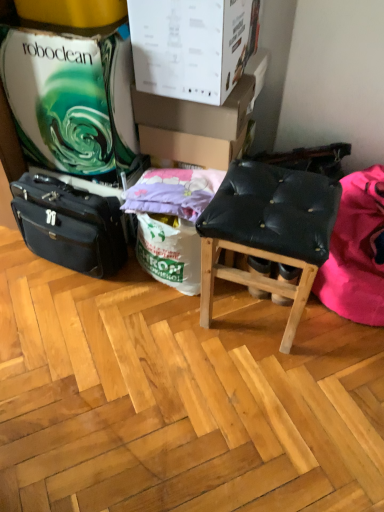
Question: Is the depth of white cardboard box at upper center, placed as the 1th cardboard box when sorted from front to back, greater than that of purple cotton pillow at center?

Choices:
 (A) no
 (B) yes

Answer: (A)

Question: Is white cardboard box at upper center, placed as the 1th cardboard box when sorted from front to back, thinner than purple cotton pillow at center?

Choices:
 (A) no
 (B) yes

Answer: (A)

Question: Is white cardboard box at upper center, placed as the third cardboard box when sorted from back to front, beside purple cotton pillow at center?

Choices:
 (A) yes
 (B) no

Answer: (B)

Question: Can you confirm if white cardboard box at upper center, placed as the 1th cardboard box when sorted from front to back, is positioned to the right of purple cotton pillow at center?

Choices:
 (A) no
 (B) yes

Answer: (B)

Question: Is white cardboard box at upper center, placed as the third cardboard box when sorted from back to front, surrounding purple cotton pillow at center?

Choices:
 (A) no
 (B) yes

Answer: (A)

Question: Choose the correct answer: Is purple cotton pillow at center inside black leather stool at center or outside it?

Choices:
 (A) inside
 (B) outside

Answer: (B)

Question: Is point (152, 170) closer or farther from the camera than point (288, 207)?

Choices:
 (A) farther
 (B) closer

Answer: (A)

Question: From the image's perspective, is purple cotton pillow at center above or below black leather stool at center?

Choices:
 (A) below
 (B) above

Answer: (B)

Question: Considering the positions of purple cotton pillow at center and black leather stool at center in the image, is purple cotton pillow at center wider or thinner than black leather stool at center?

Choices:
 (A) thin
 (B) wide

Answer: (A)

Question: From the image's perspective, relative to cardboard box at upper center, which appears as the 2th cardboard box when viewed from the back, is purple cotton pillow at center above or below?

Choices:
 (A) above
 (B) below

Answer: (B)

Question: Visually, is purple cotton pillow at center positioned to the left or to the right of cardboard box at upper center, which appears as the 2th cardboard box when viewed from the back?

Choices:
 (A) right
 (B) left

Answer: (B)

Question: Considering the positions of purple cotton pillow at center and cardboard box at upper center, acting as the second cardboard box starting from the front, in the image, is purple cotton pillow at center bigger or smaller than cardboard box at upper center, acting as the second cardboard box starting from the front,?

Choices:
 (A) small
 (B) big

Answer: (A)

Question: Would you say purple cotton pillow at center is inside or outside cardboard box at upper center, acting as the second cardboard box starting from the front?

Choices:
 (A) inside
 (B) outside

Answer: (B)

Question: Is black leather stool at center in front of or behind pink fabric at right in the image?

Choices:
 (A) front
 (B) behind

Answer: (A)

Question: Is point (276, 202) closer or farther from the camera than point (349, 224)?

Choices:
 (A) farther
 (B) closer

Answer: (B)